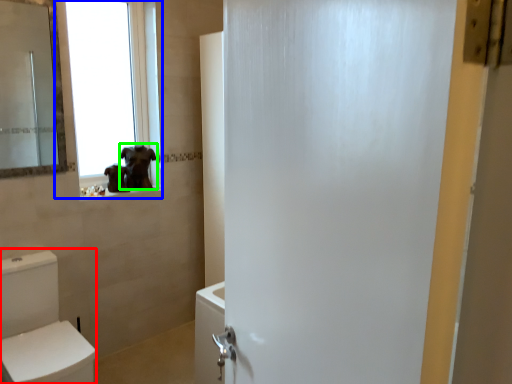
Question: Considering the real-world distances, which object is farthest from toilet bowl (highlighted by a red box)? window (highlighted by a blue box) or animal (highlighted by a green box)?

Choices:
 (A) window
 (B) animal

Answer: (A)